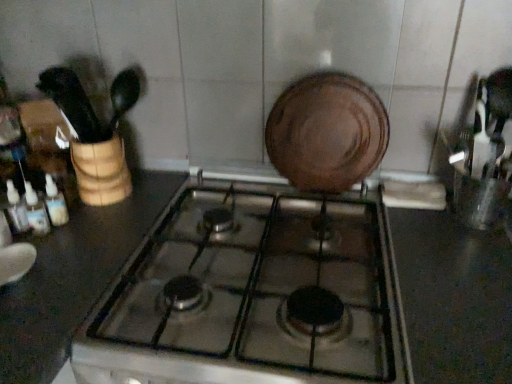
Question: From the image's perspective, is translucent plastic bottles at left, the 3th bottle when ordered from left to right, on black glossy countertop at center?

Choices:
 (A) no
 (B) yes

Answer: (B)

Question: From the image's perspective, is translucent plastic bottles at left, the 3th bottle when ordered from left to right, under black glossy countertop at center?

Choices:
 (A) yes
 (B) no

Answer: (B)

Question: Is the depth of translucent plastic bottles at left, placed as the first bottle when sorted from right to left, less than that of black glossy countertop at center?

Choices:
 (A) no
 (B) yes

Answer: (A)

Question: Is there a large distance between translucent plastic bottles at left, placed as the first bottle when sorted from right to left, and black glossy countertop at center?

Choices:
 (A) yes
 (B) no

Answer: (B)

Question: Does translucent plastic bottles at left, placed as the first bottle when sorted from right to left, have a lesser height compared to black glossy countertop at center?

Choices:
 (A) yes
 (B) no

Answer: (A)

Question: Considering the relative sizes of translucent plastic bottles at left, the 3th bottle when ordered from left to right, and black glossy countertop at center in the image provided, is translucent plastic bottles at left, the 3th bottle when ordered from left to right, taller than black glossy countertop at center?

Choices:
 (A) no
 (B) yes

Answer: (A)

Question: From the image's perspective, is translucent plastic bottles at left, the 1th bottle when ordered from left to right, under translucent plastic bottles at left, which appears as the second bottle when viewed from the right?

Choices:
 (A) yes
 (B) no

Answer: (B)

Question: Is translucent plastic bottles at left, the 2th bottle positioned from the left, completely or partially inside translucent plastic bottles at left, which is the third bottle from right to left?

Choices:
 (A) no
 (B) yes

Answer: (A)

Question: Does translucent plastic bottles at left, the 1th bottle when ordered from left to right, have a lesser height compared to translucent plastic bottles at left, which appears as the second bottle when viewed from the right?

Choices:
 (A) no
 (B) yes

Answer: (A)

Question: From a real-world perspective, is translucent plastic bottles at left, which is the third bottle from right to left, beneath translucent plastic bottles at left, the 2th bottle positioned from the left?

Choices:
 (A) no
 (B) yes

Answer: (A)

Question: Does translucent plastic bottles at left, which is the third bottle from right to left, have a smaller size compared to translucent plastic bottles at left, which appears as the second bottle when viewed from the right?

Choices:
 (A) no
 (B) yes

Answer: (A)

Question: From a real-world perspective, is translucent plastic bottles at left, which is the third bottle from right to left, over translucent plastic bottles at left, the 2th bottle positioned from the left?

Choices:
 (A) no
 (B) yes

Answer: (B)

Question: Would you consider metallic glass gas stove at center to be distant from brown matte plate at center?

Choices:
 (A) no
 (B) yes

Answer: (A)